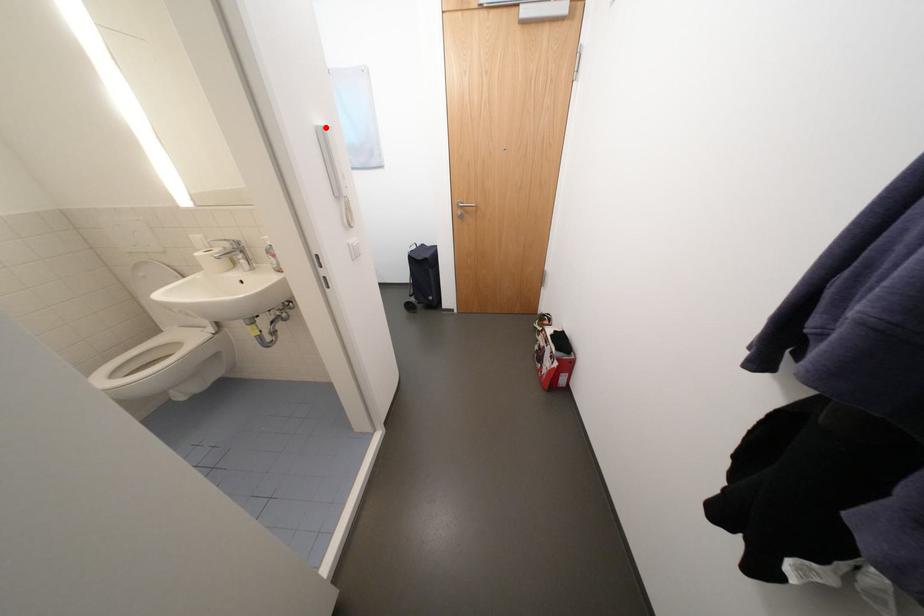
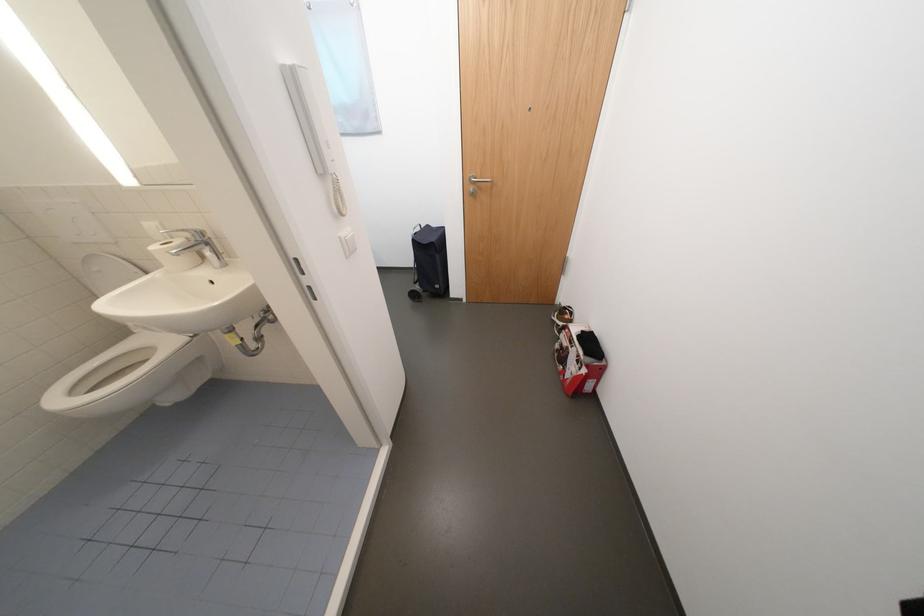
Question: I am providing you with two images of the same scene from different viewpoints. In image1, a red point is highlighted. Considering the same 3D point in image2, which of the following is correct?

Choices:
 (A) It is closer
 (B) It is farther

Answer: (B)